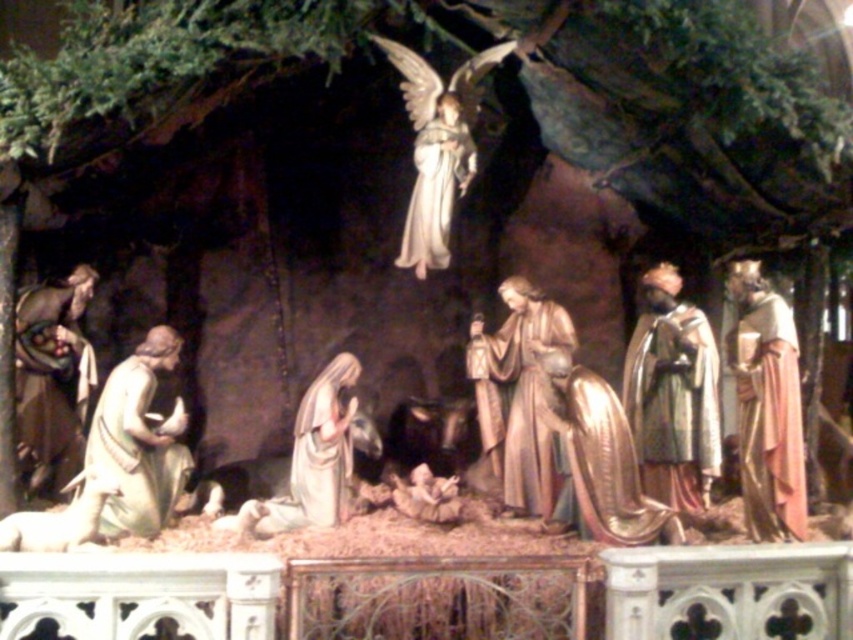
Is gold metallic robe at center above gold metallic angel at center?

Indeed, gold metallic robe at center is positioned over gold metallic angel at center.

Between point (506, 464) and point (540, 412), which one is positioned behind?

The point (506, 464) is behind.

You are a GUI agent. You are given a task and a screenshot of the screen. Output one action in this format:
    pyautogui.click(x=<x>, y=<y>)
    Task: Click on the gold metallic robe at center
    The height and width of the screenshot is (640, 853).
    Given the screenshot: What is the action you would take?
    pyautogui.click(x=519, y=394)

From the picture: Does gold metallic angel at center appear on the left side of matte gold statue at center?

No, gold metallic angel at center is not to the left of matte gold statue at center.

Which is in front, point (613, 449) or point (302, 412)?

Positioned in front is point (613, 449).

This screenshot has height=640, width=853. What are the coordinates of `gold metallic angel at center` in the screenshot? It's located at (601, 458).

I want to click on gold metallic robe at right, so click(x=766, y=406).

Which is behind, point (755, 490) or point (421, 173)?

The point (421, 173) is behind.

Who is more forward, (x=769, y=515) or (x=450, y=97)?

Point (x=769, y=515) is more forward.

Identify the location of gold metallic robe at right. This screenshot has width=853, height=640. (766, 406).